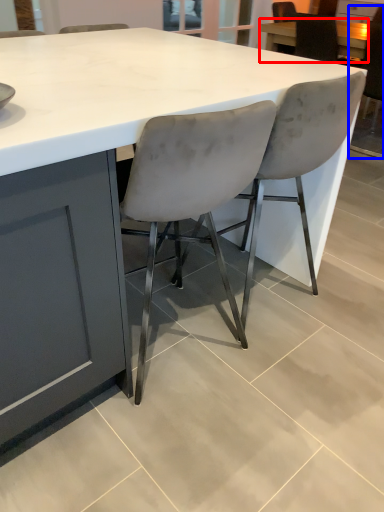
Question: Among these objects, which one is farthest to the camera, table (highlighted by a red box) or chair (highlighted by a blue box)?

Choices:
 (A) table
 (B) chair

Answer: (A)